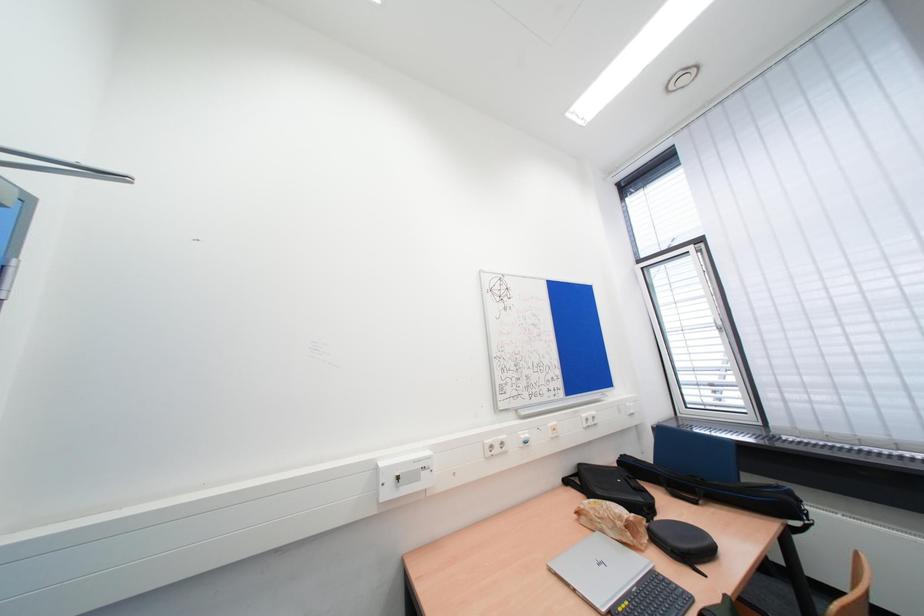
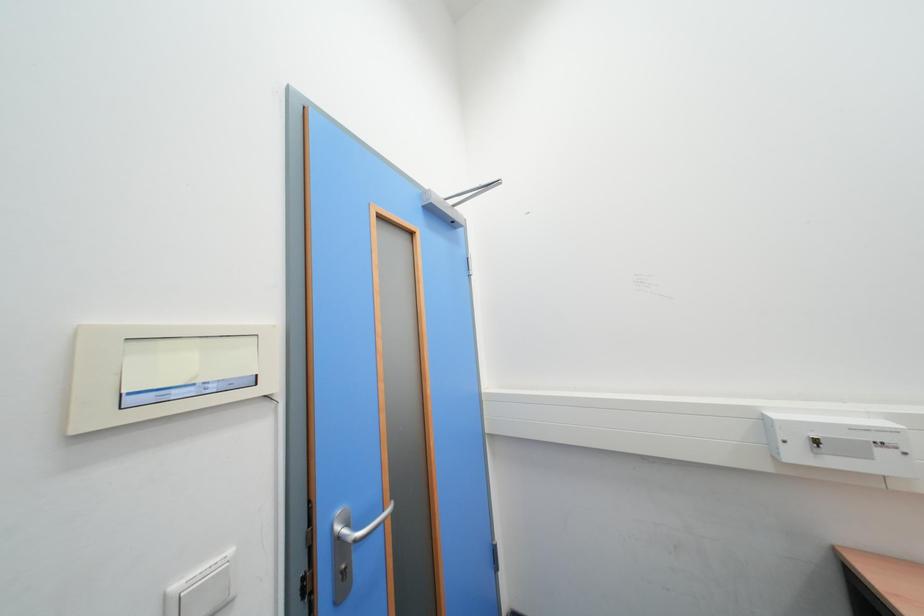
Question: The camera is either moving clockwise (left) or counter-clockwise (right) around the object. The first image is from the beginning of the video and the second image is from the end. Is the camera moving left or right when shooting the video?

Choices:
 (A) Left
 (B) Right

Answer: (B)